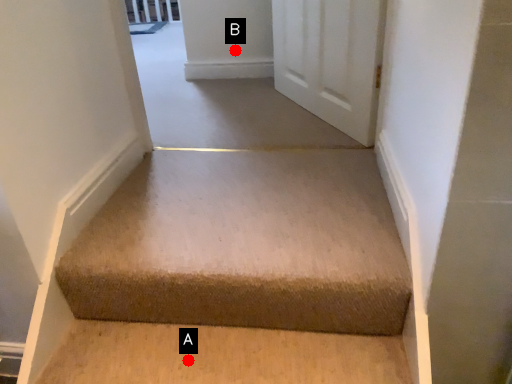
Question: Two points are circled on the image, labeled by A and B beside each circle. Which point is farther to the camera?

Choices:
 (A) A is further
 (B) B is further

Answer: (B)